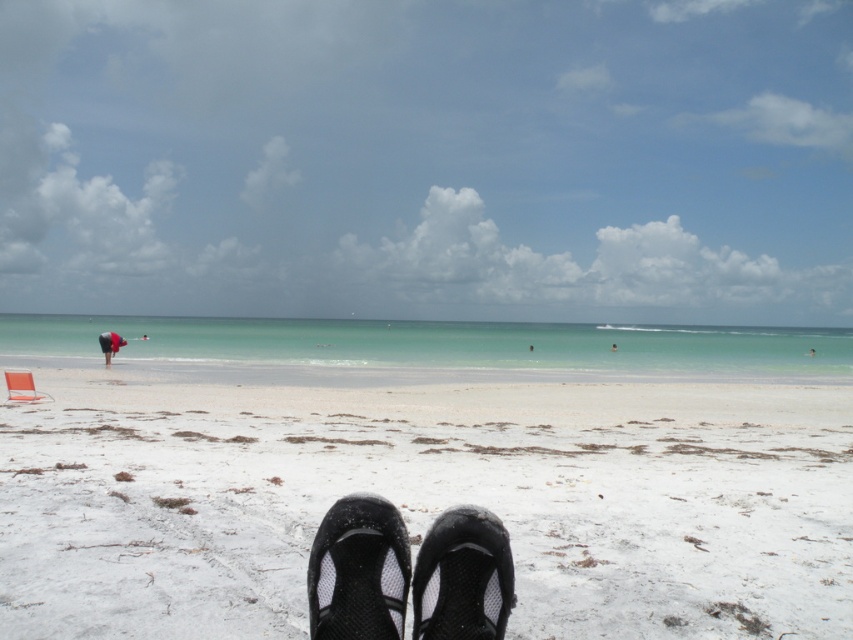
Based on the coordinates provided, where is the white sandy beach at center located in the image?

The white sandy beach at center is located at the 2D coordinates point (x=427, y=500) in the image.